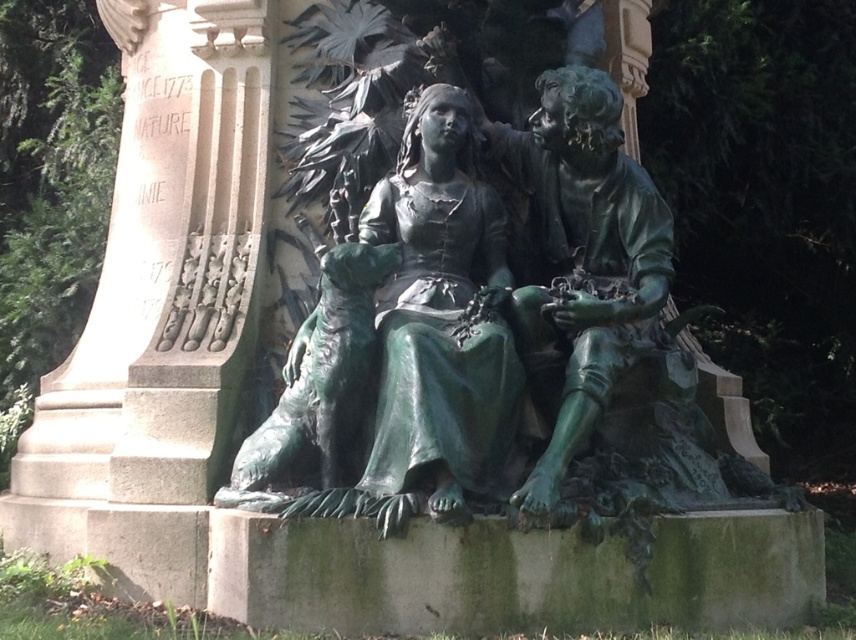
Question: Which point appears closest to the camera in this image?

Choices:
 (A) [x=446, y=92]
 (B) [x=566, y=132]

Answer: (B)

Question: From the image, what is the correct spatial relationship of green patina statue at center in relation to green patina statue at right?

Choices:
 (A) below
 (B) above

Answer: (A)

Question: Which point is closer to the camera taking this photo?

Choices:
 (A) (397, 348)
 (B) (568, 308)

Answer: (A)

Question: Can you confirm if green patina statue at center is wider than green patina statue at right?

Choices:
 (A) no
 (B) yes

Answer: (A)

Question: Which point is farther to the camera?

Choices:
 (A) (443, 506)
 (B) (531, 346)

Answer: (B)

Question: Is green patina statue at center bigger than green patina statue at right?

Choices:
 (A) yes
 (B) no

Answer: (B)